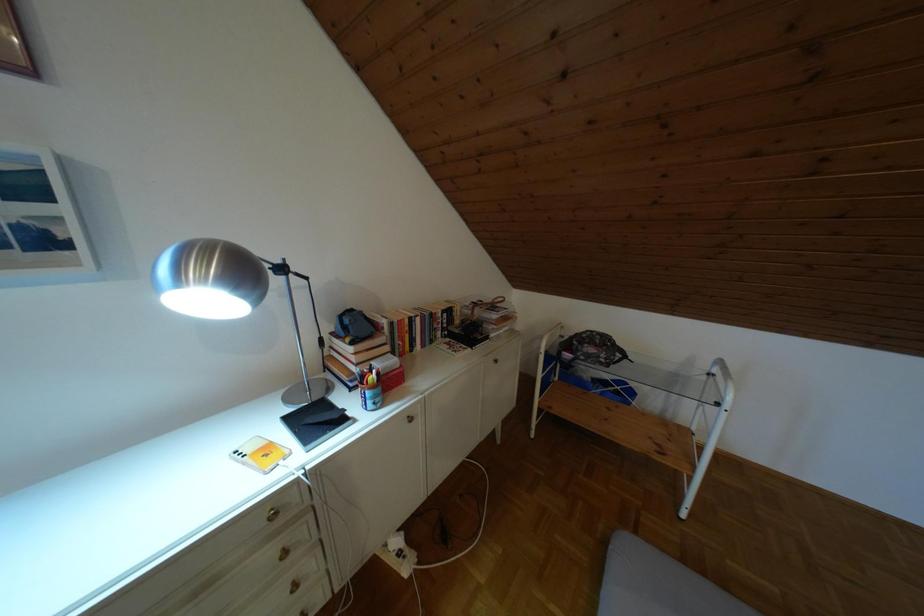
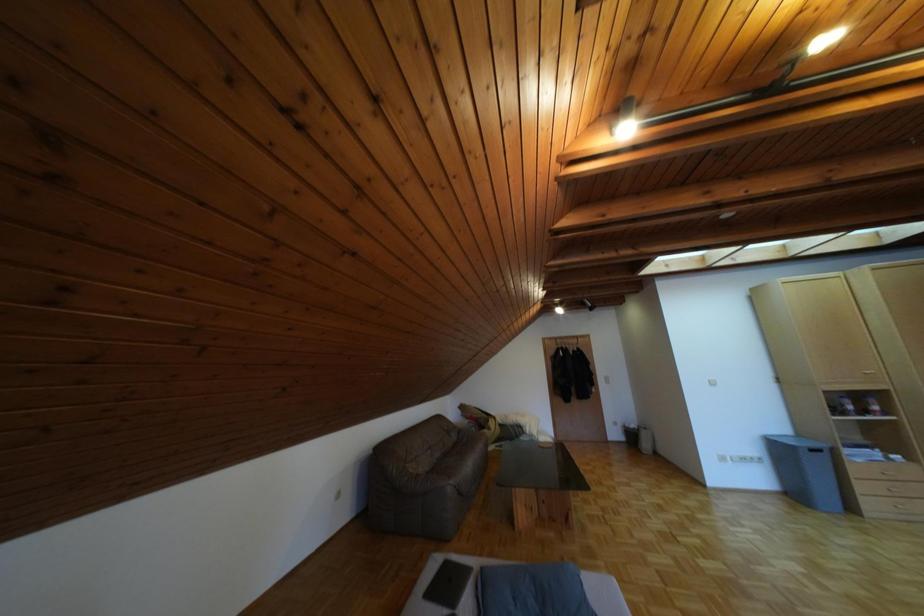
Question: The images are taken continuously from a first-person perspective. In which direction is your viewpoint rotating?

Choices:
 (A) Left
 (B) Right
 (C) Up
 (D) Down

Answer: (B)